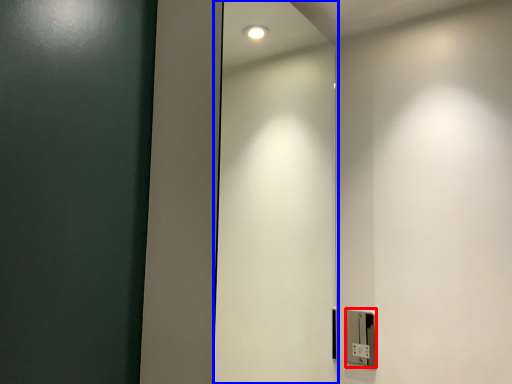
Question: Which object is closer to the camera taking this photo, light switch (highlighted by a red box) or elevator door (highlighted by a blue box)?

Choices:
 (A) light switch
 (B) elevator door

Answer: (B)